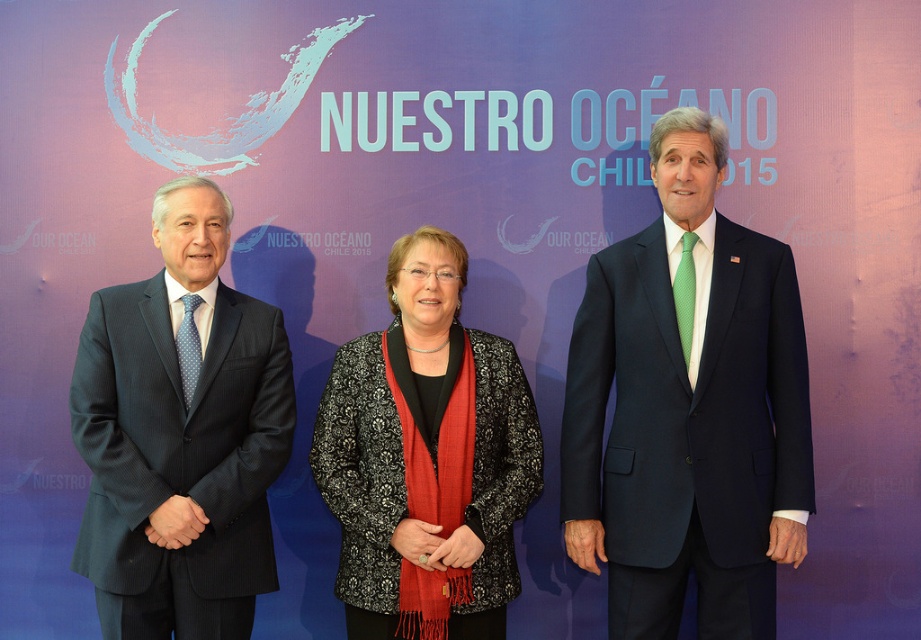
You are at a conference and see this image. The dark blue pinstripe suit at left is represented by point (181, 435). Can you determine the location of the dark blue pinstripe suit at left relative to the center of the image?

The dark blue pinstripe suit at left is located at point (181, 435), which is to the right and slightly above the center of the image.

You are organizing a photo shoot and need to ensure there is enough space between the two individuals wearing the navy blue suit at center and dark blue pinstripe suit at left. The minimum required distance for the camera setup is 4 feet. Based on the scene description, is the current spacing sufficient?

The navy blue suit at center and dark blue pinstripe suit at left are 3.81 feet apart, which is less than the required 4 feet. Therefore, the current spacing is insufficient for the camera setup.